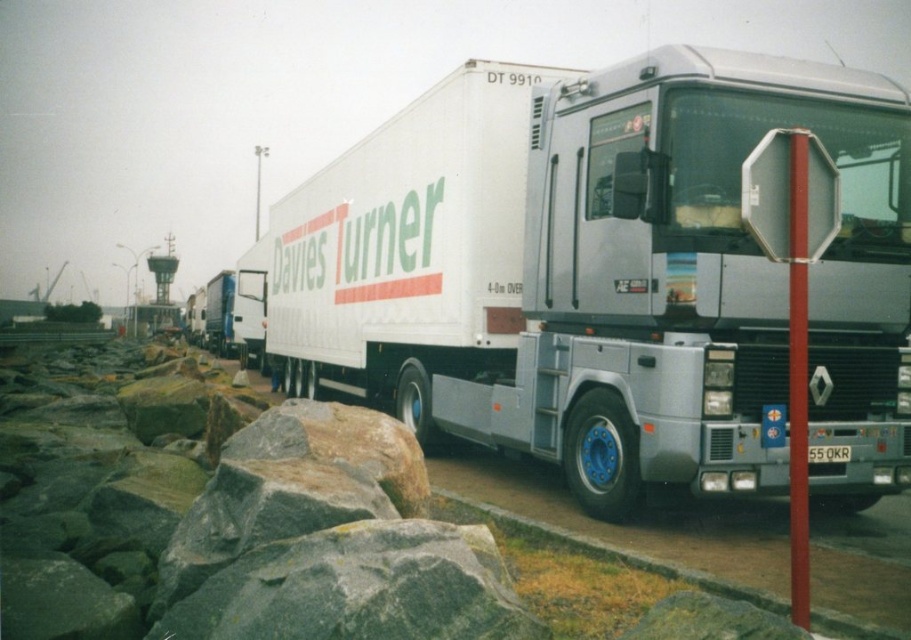
Which is behind, point (494, 332) or point (761, 180)?

The point (494, 332) is more distant.

Based on the photo, is white matte trailer truck at center positioned behind metallic reflective octagonal sign at center-right?

Yes.

Does point (469, 356) lie behind point (835, 230)?

Yes.

This screenshot has height=640, width=911. Identify the location of white matte trailer truck at center. (604, 275).

Describe the element at coordinates (604, 275) in the screenshot. This screenshot has width=911, height=640. I see `white matte trailer truck at center` at that location.

Is white matte trailer truck at center below red plastic pole at center right?

Incorrect, white matte trailer truck at center is not positioned below red plastic pole at center right.

Describe the element at coordinates (604, 275) in the screenshot. The width and height of the screenshot is (911, 640). I see `white matte trailer truck at center` at that location.

Identify the location of white matte trailer truck at center. (604, 275).

Does metallic reflective octagonal sign at center-right appear under red plastic pole at center right?

Incorrect, metallic reflective octagonal sign at center-right is not positioned below red plastic pole at center right.

Between metallic reflective octagonal sign at center-right and red plastic pole at center right, which one has more height?

With more height is red plastic pole at center right.

Between point (763, 248) and point (805, 332), which one is positioned behind?

The point (763, 248) is more distant.

You are a GUI agent. You are given a task and a screenshot of the screen. Output one action in this format:
    pyautogui.click(x=<x>, y=<y>)
    Task: Click on the metallic reflective octagonal sign at center-right
    Image resolution: width=911 pixels, height=640 pixels.
    Given the screenshot: What is the action you would take?
    pyautogui.click(x=790, y=196)